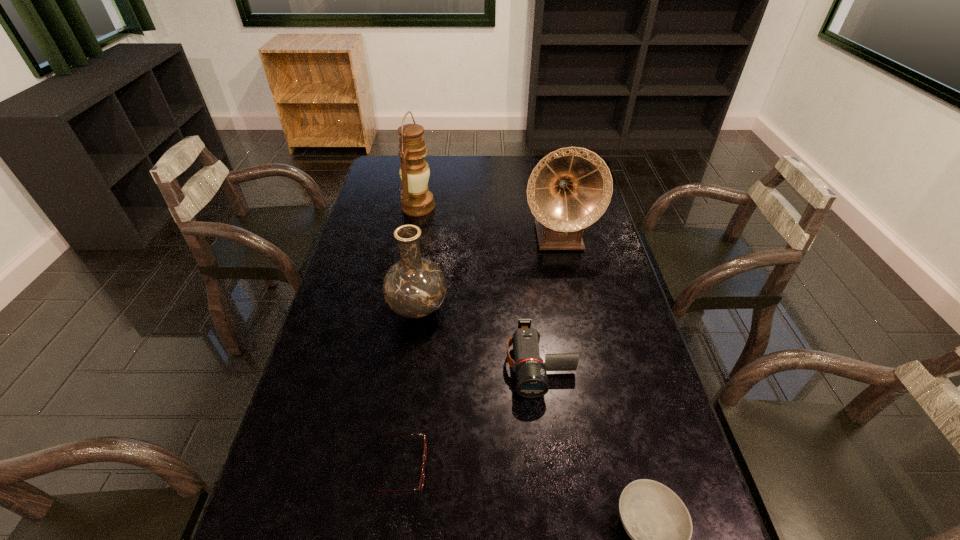
The width and height of the screenshot is (960, 540). In order to click on oil lamp in this screenshot , I will do `click(417, 200)`.

The width and height of the screenshot is (960, 540). I want to click on phonograph record, so click(569, 189).

Image resolution: width=960 pixels, height=540 pixels. I want to click on the fourth nearest object, so click(x=414, y=287).

I want to click on vase, so click(414, 287).

Image resolution: width=960 pixels, height=540 pixels. Identify the location of the fourth tallest object. (531, 377).

Locate an element on the screen. camcorder is located at coordinates (531, 377).

Locate an element on the screen. spectacles is located at coordinates (420, 488).

Identify the location of free space located on the front of the oil lamp. The height and width of the screenshot is (540, 960). (412, 241).

The width and height of the screenshot is (960, 540). I want to click on vacant space located 0.160m on the horn of the phonograph record, so click(569, 292).

Identify the location of free space located 0.130m on the front of the fourth shortest object. (409, 370).